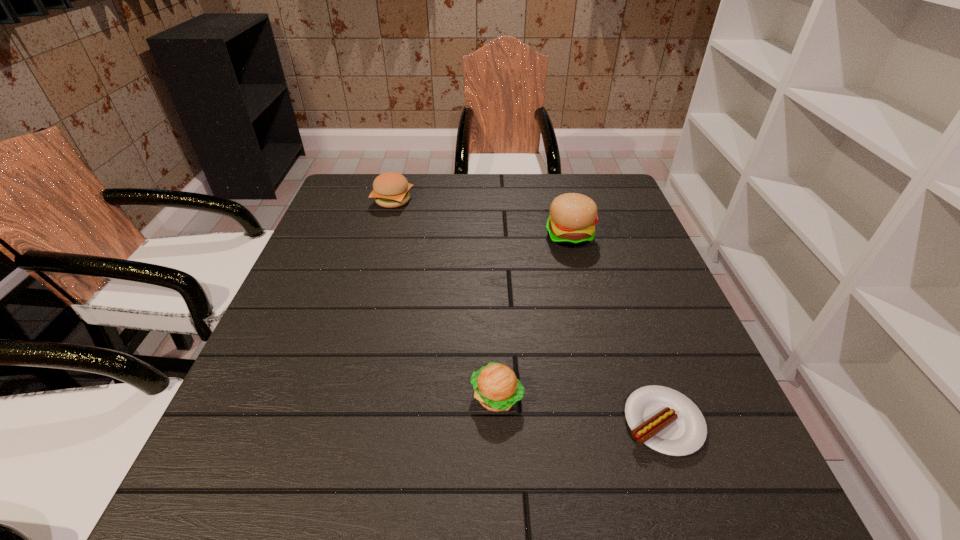
The height and width of the screenshot is (540, 960). Identify the location of vacant space in between the second hamburger from right to left and the farthest object. (444, 299).

Identify which object is the third closest to the shortest object. Please provide its 2D coordinates. Your answer should be formatted as a tuple, i.e. [(x, y)], where the tuple contains the x and y coordinates of a point satisfying the conditions above.

[(391, 190)]

Locate an element on the screen. The image size is (960, 540). object that is the second nearest to the nearest hamburger is located at coordinates [573, 216].

Choose which hamburger is the nearest neighbor to the sausage. Please provide its 2D coordinates. Your answer should be formatted as a tuple, i.e. [(x, y)], where the tuple contains the x and y coordinates of a point satisfying the conditions above.

[(496, 387)]

This screenshot has width=960, height=540. What are the coordinates of `the second closest hamburger to the third object from right to left` in the screenshot? It's located at (391, 190).

I want to click on vacant region that satisfies the following two spatial constraints: 1. on the front side of the leftmost hamburger; 2. on the left side of the tallest object, so click(383, 237).

The width and height of the screenshot is (960, 540). Find the location of `vacant area in the image that satisfies the following two spatial constraints: 1. on the front side of the tallest object; 2. on the right side of the farthest hamburger`. vacant area in the image that satisfies the following two spatial constraints: 1. on the front side of the tallest object; 2. on the right side of the farthest hamburger is located at coordinates (383, 237).